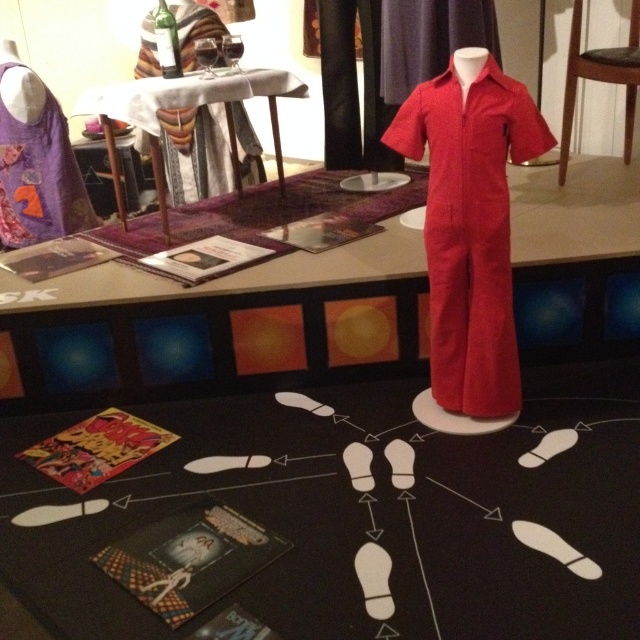
You are organizing an event and need to determine if the corduroy jumpsuit at center can be placed on the wooden table at upper center without exceeding its surface area. Can it fit?

The corduroy jumpsuit at center occupies less space than the wooden table at upper center, so it can fit on the table.

You are a guest at a themed event and see the matte wood table at center and the matte red jumpsuit at upper center. Which object is located to the right of the other?

The matte wood table at center is positioned on the right side of the matte red jumpsuit at upper center, so the table is to the right of the jumpsuit.